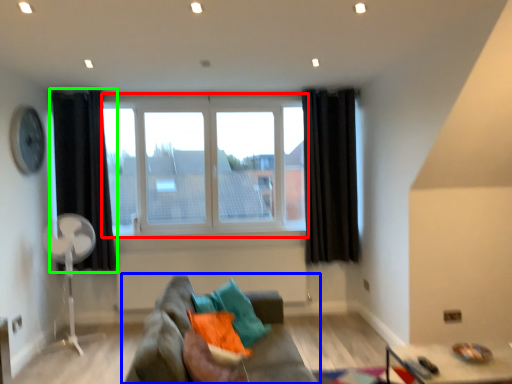
Question: Based on their relative distances, which object is farther from window (highlighted by a red box)? Choose from studio couch (highlighted by a blue box) and curtain (highlighted by a green box).

Choices:
 (A) studio couch
 (B) curtain

Answer: (A)